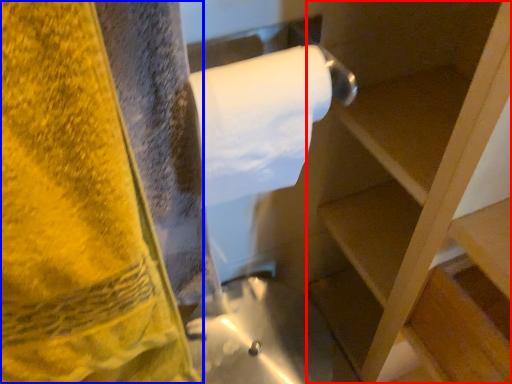
Question: Which object appears closest to the camera in this image, shelf (highlighted by a red box) or towel (highlighted by a blue box)?

Choices:
 (A) shelf
 (B) towel

Answer: (A)